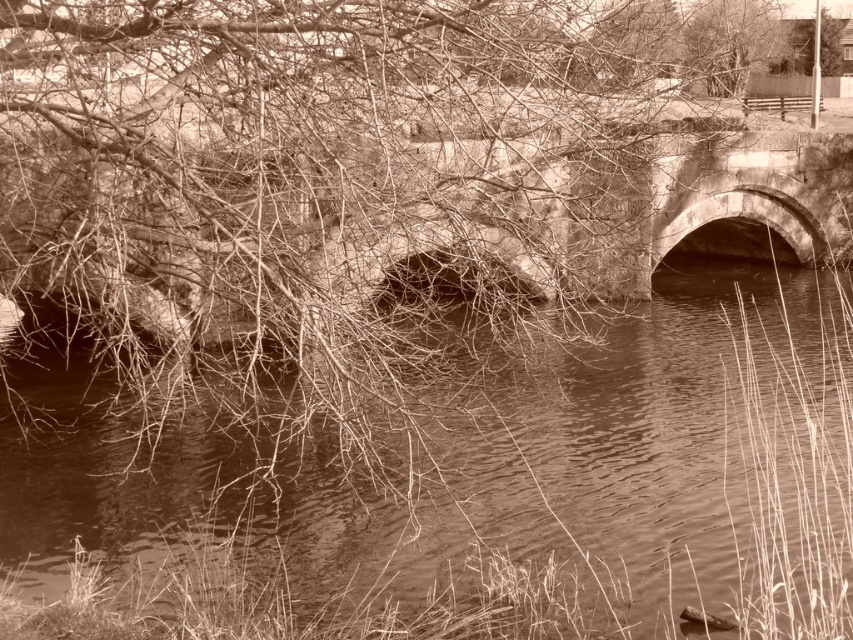
You are a photographer standing at the edge of the water in the image. You want to capture a photo that includes both the stone bridge at center and the bare branches at upper center. Based on their positions, will the branches block the view of the bridge in your photo?

The stone bridge at center is located below the bare branches at upper center, so the branches may partially block the view of the bridge in your photo.

You are a photographer planning to capture the stone bridge at center and the brown water at center in a single frame. Based on their positions and sizes, which object would you need to adjust your camera angle to include fully in the shot?

The brown water at center might be wider than the stone bridge at center, so you would need to adjust your camera angle to ensure the brown water at center fits entirely within the frame.